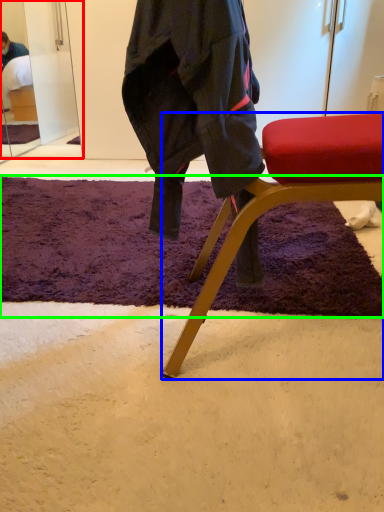
Question: Which object is positioned closest to mirror (highlighted by a red box)? Select from chair (highlighted by a blue box) and mat (highlighted by a green box).

Choices:
 (A) chair
 (B) mat

Answer: (B)